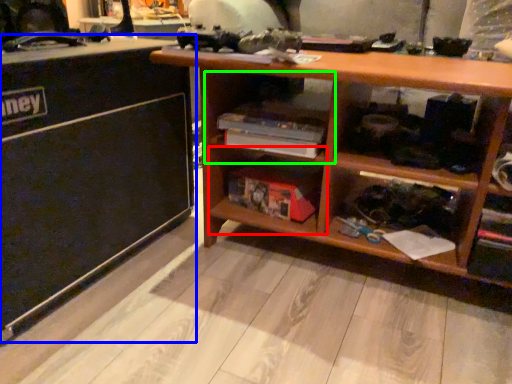
Question: Considering the real-world distances, which object is farthest from shelf (highlighted by a red box)? table (highlighted by a blue box) or cabinet (highlighted by a green box)?

Choices:
 (A) table
 (B) cabinet

Answer: (A)